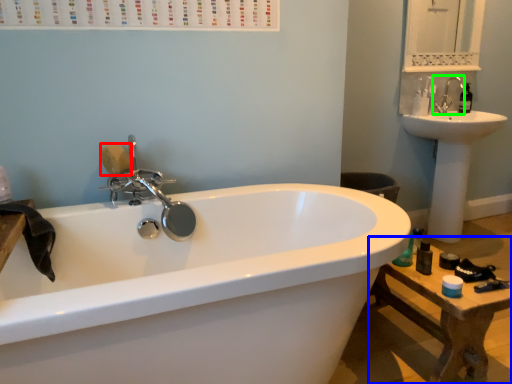
Question: Which object is the closest to the soap (highlighted by a red box)? Choose among these: table (highlighted by a blue box) or tap (highlighted by a green box).

Choices:
 (A) table
 (B) tap

Answer: (A)